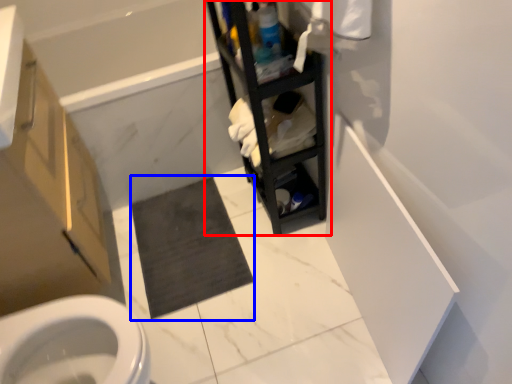
Question: Which object is further to the camera taking this photo, shelf (highlighted by a red box) or bath mat (highlighted by a blue box)?

Choices:
 (A) shelf
 (B) bath mat

Answer: (B)